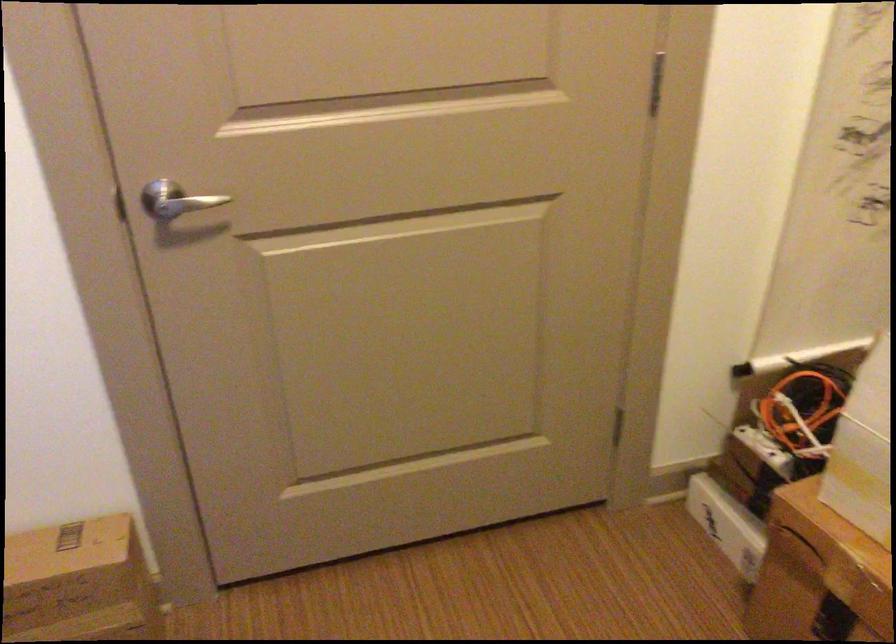
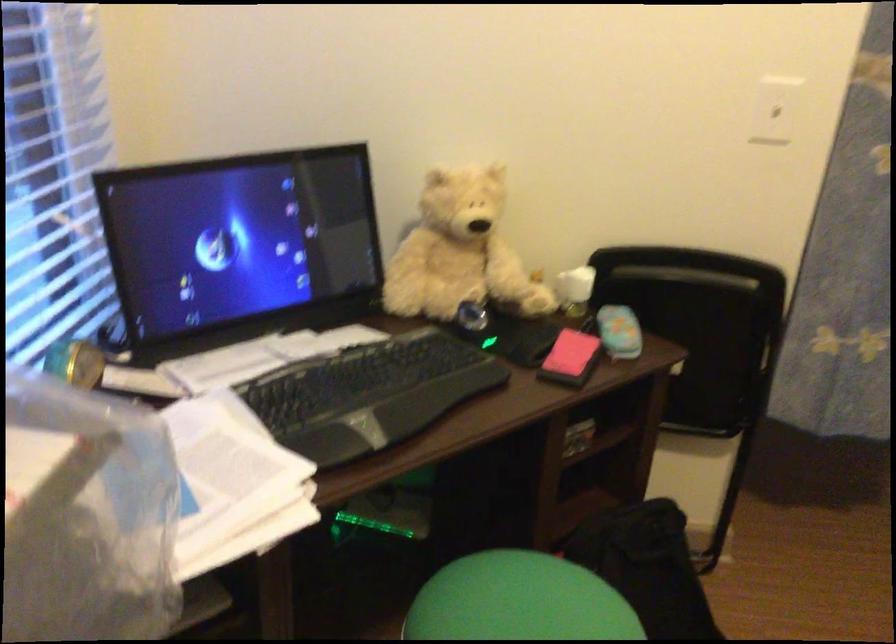
First-person continuous shooting, in which direction is the camera rotating?

The camera rotated toward left-down.